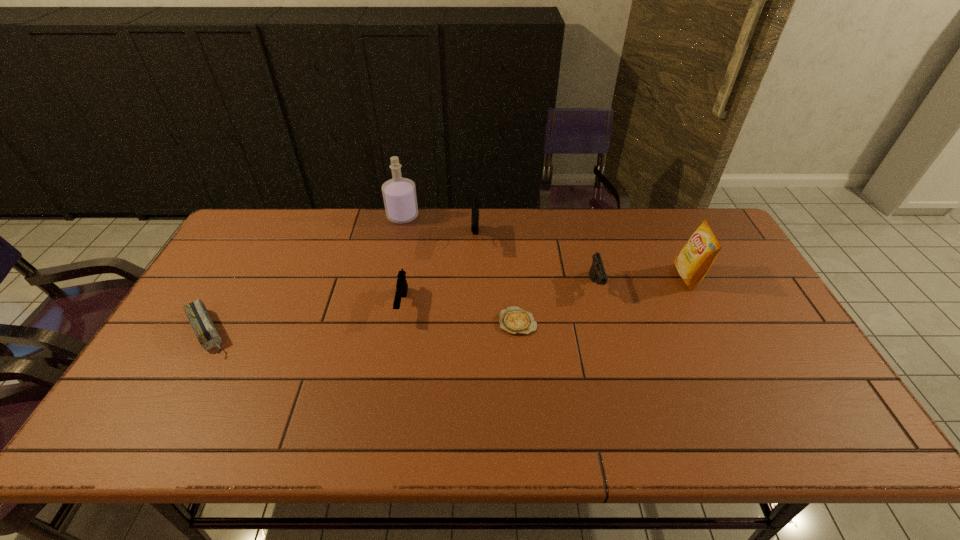
The width and height of the screenshot is (960, 540). Identify the location of the third object from right to left. (514, 320).

Identify the location of free space located on the front of the perfume. The width and height of the screenshot is (960, 540). (384, 307).

Find the location of a particular element. The image size is (960, 540). free location located on the front-facing side of the crisp (potato chip) is located at coordinates (548, 277).

Identify the location of vacant space situated 0.150m on the front-facing side of the crisp (potato chip). (627, 277).

Identify the location of free space located 0.370m on the front-facing side of the crisp (potato chip). This screenshot has width=960, height=540. (555, 277).

Find the location of `vacant space located 0.080m at the barrel of the second pistol from right to left`. vacant space located 0.080m at the barrel of the second pistol from right to left is located at coordinates (475, 273).

This screenshot has width=960, height=540. I want to click on blank space located at the barrel of the rightmost pistol, so click(x=629, y=409).

In order to click on vacant space located 0.060m on the front-facing side of the leftmost pistol in this screenshot , I will do `click(396, 342)`.

This screenshot has width=960, height=540. What are the coordinates of `vacant space located 0.330m on the right of the pencil box` in the screenshot? It's located at (356, 332).

Where is `free spot located on the right of the fifth object from left to right`? free spot located on the right of the fifth object from left to right is located at coordinates (609, 322).